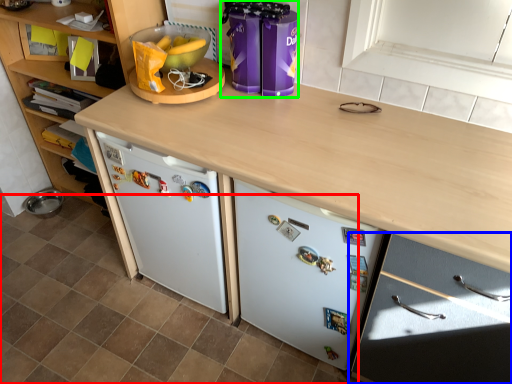
Question: Considering the real-world distances, which object is farthest from tile (highlighted by a red box)? cabinetry (highlighted by a blue box) or appliance (highlighted by a green box)?

Choices:
 (A) cabinetry
 (B) appliance

Answer: (B)